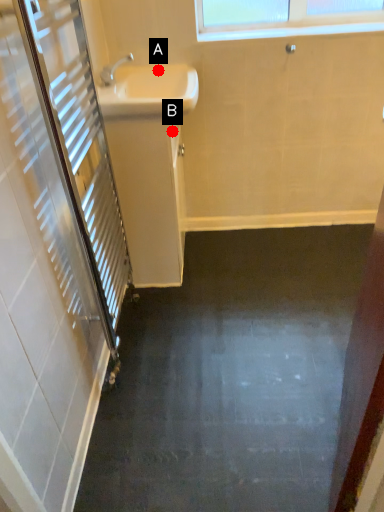
Question: Two points are circled on the image, labeled by A and B beside each circle. Which point is closer to the camera?

Choices:
 (A) A is closer
 (B) B is closer

Answer: (B)